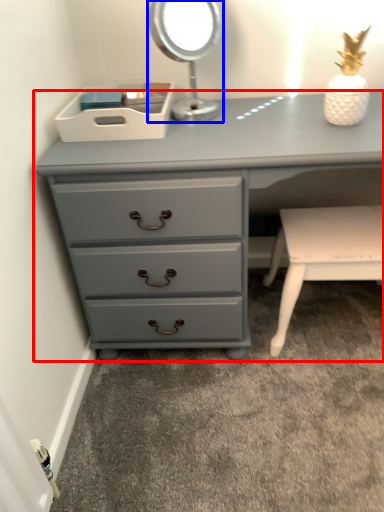
Question: Which object is further to the camera taking this photo, chest of drawers (highlighted by a red box) or bedside lamp (highlighted by a blue box)?

Choices:
 (A) chest of drawers
 (B) bedside lamp

Answer: (B)